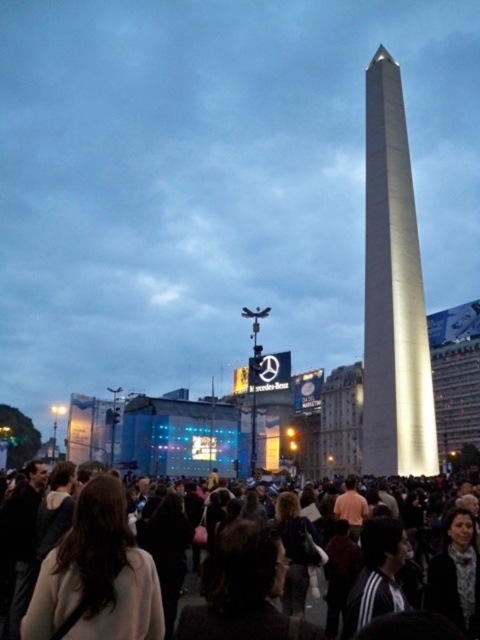
Question: Can you confirm if shiny metallic obelisk at center is thinner than dark brown hair at center?

Choices:
 (A) yes
 (B) no

Answer: (A)

Question: Estimate the real-world distances between objects in this image. Which object is farther from the light brown hair at center?

Choices:
 (A) dark brown hair at center
 (B) shiny metallic obelisk at center

Answer: (B)

Question: Which point is closer to the camera?

Choices:
 (A) (374, 349)
 (B) (84, 604)

Answer: (B)

Question: Does shiny metallic obelisk at center appear over light brown hair at center?

Choices:
 (A) yes
 (B) no

Answer: (A)

Question: Estimate the real-world distances between objects in this image. Which object is closer to the shiny metallic obelisk at center?

Choices:
 (A) light brown hair at center
 (B) dark brown hair at center

Answer: (B)

Question: Can you confirm if shiny metallic obelisk at center is smaller than dark brown hair at center?

Choices:
 (A) yes
 (B) no

Answer: (A)